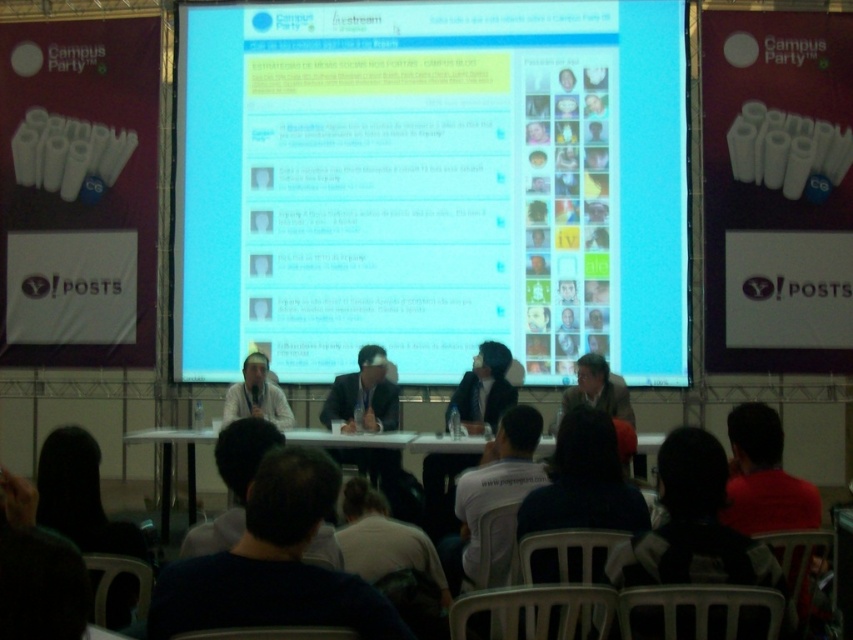
You are a photographer at the event and need to capture a photo of both the dark suit at center and the light brown leather jacket at center. Which one should you focus on first to ensure it appears larger in the photo?

The dark suit at center is much taller than the light brown leather jacket at center, so you should focus on the dark suit at center first to ensure it appears larger in the photo.